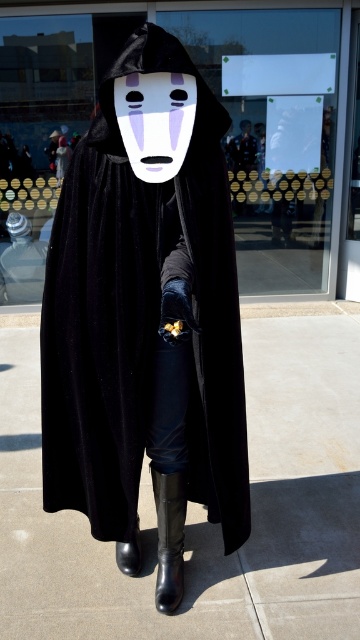
You are a costume designer examining the No Face costume. You need to determine which part of the costume is bigger in size between the black velvet cloak at center and the white matte mask at center. Which one is larger?

The black velvet cloak at center has a larger size compared to the white matte mask at center, so the cloak is bigger.

Consider the image. You are a costume designer preparing to modify the costume of the person in the image. You need to attach a decorative pendant to the black velvet cloak at center so that it hangs down to the black rubber boot at lower center. How long should the chain be to ensure the pendant reaches the boot?

The black velvet cloak at center is 16.27 inches from the black rubber boot at lower center, so the chain should be at least 16.27 inches long to ensure the pendant reaches the boot.

You are a costume designer analyzing the image of a No Face costume. The costume includes a black velvet cloak at center and a white matte mask at center. Which object in the costume is taller?

The black velvet cloak at center is much taller than the white matte mask at center.